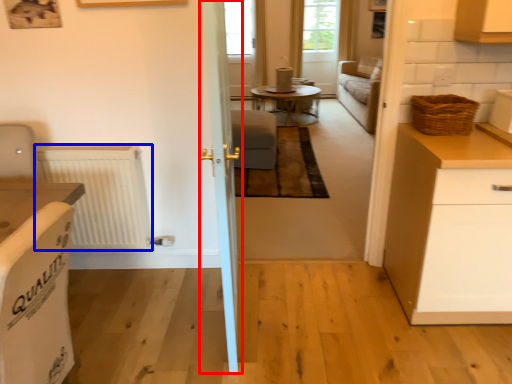
Question: Which object appears closest to the camera in this image, door (highlighted by a red box) or radiator (highlighted by a blue box)?

Choices:
 (A) door
 (B) radiator

Answer: (A)